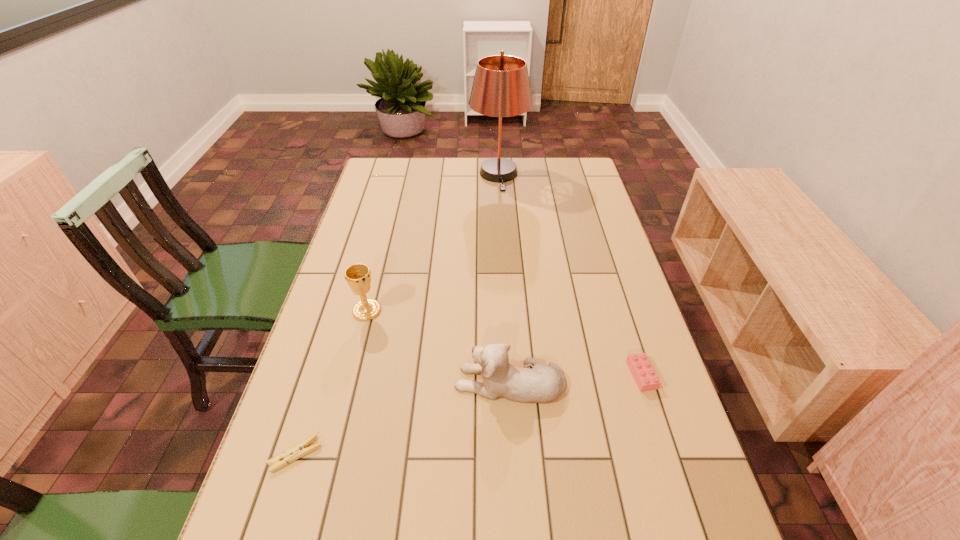
Identify the location of vacant space located 0.140m on the front-facing side of the puppy. This screenshot has width=960, height=540. (396, 382).

This screenshot has width=960, height=540. I want to click on vacant space located 0.100m on the front-facing side of the puppy, so click(x=412, y=382).

I want to click on vacant space situated on the front-facing side of the puppy, so click(x=361, y=382).

Locate an element on the screen. vacant space located on the back of the Lego is located at coordinates (630, 337).

Where is `free spot located on the right of the nearest object`? free spot located on the right of the nearest object is located at coordinates (344, 455).

At what (x,y) coordinates should I click in order to perform the action: click on object that is positioned at the far edge. Please return your answer as a coordinate pair (x, y). The height and width of the screenshot is (540, 960). Looking at the image, I should click on click(x=501, y=88).

Where is `chalice that is at the left edge`? The image size is (960, 540). chalice that is at the left edge is located at coordinates (358, 276).

At what (x,y) coordinates should I click in order to perform the action: click on clothespin that is positioned at the left edge. Please return your answer as a coordinate pair (x, y). The width and height of the screenshot is (960, 540). Looking at the image, I should click on (298, 451).

I want to click on object that is positioned at the right edge, so click(x=644, y=374).

This screenshot has width=960, height=540. What are the coordinates of `free space at the far edge of the desktop` in the screenshot? It's located at (469, 158).